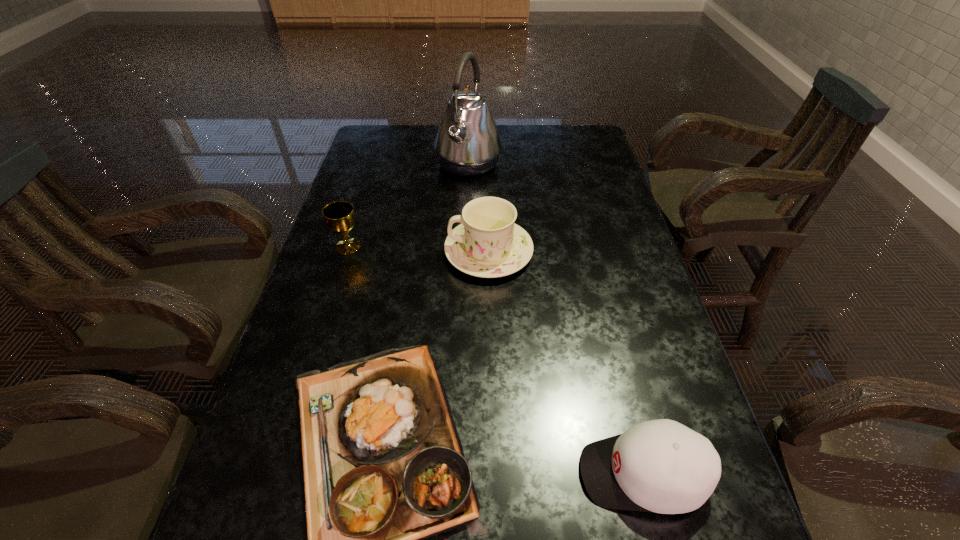
Identify the location of the tallest object. (467, 143).

I want to click on the farthest object, so click(x=467, y=143).

Where is `chinaware`? This screenshot has width=960, height=540. chinaware is located at coordinates (488, 244).

You are a GUI agent. You are given a task and a screenshot of the screen. Output one action in this format:
    pyautogui.click(x=<x>, y=<y>)
    Task: Click on the chalice
    The width and height of the screenshot is (960, 540).
    Given the screenshot: What is the action you would take?
    pyautogui.click(x=339, y=216)

You are a GUI agent. You are given a task and a screenshot of the screen. Output one action in this format:
    pyautogui.click(x=<x>, y=<y>)
    Task: Click on the baseball cap
    The width and height of the screenshot is (960, 540).
    Given the screenshot: What is the action you would take?
    pyautogui.click(x=661, y=466)

Find the location of `vacant space located 0.060m on the front of the farthest object`. vacant space located 0.060m on the front of the farthest object is located at coordinates (468, 198).

The image size is (960, 540). In order to click on free spot located 0.050m on the handle side of the chinaware in this screenshot , I will do `click(426, 252)`.

Locate an element on the screen. Image resolution: width=960 pixels, height=540 pixels. vacant area located 0.100m on the handle side of the chinaware is located at coordinates (408, 252).

You are a GUI agent. You are given a task and a screenshot of the screen. Output one action in this format:
    pyautogui.click(x=<x>, y=<y>)
    Task: Click on the vacant space located on the handle side of the chinaware
    The width and height of the screenshot is (960, 540).
    Given the screenshot: What is the action you would take?
    tap(325, 252)

Image resolution: width=960 pixels, height=540 pixels. What are the coordinates of `vacant space located 0.060m on the front of the chalice` in the screenshot? It's located at (340, 272).